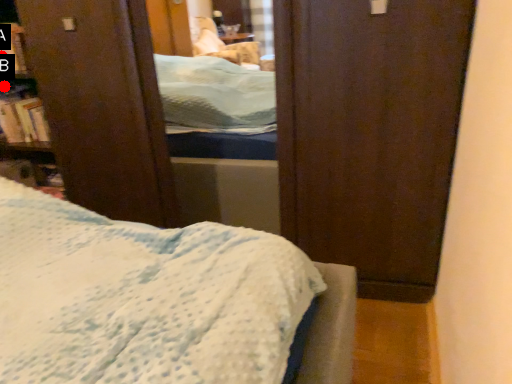
Question: Two points are circled on the image, labeled by A and B beside each circle. Which point appears closest to the camera in this image?

Choices:
 (A) A is closer
 (B) B is closer

Answer: (A)